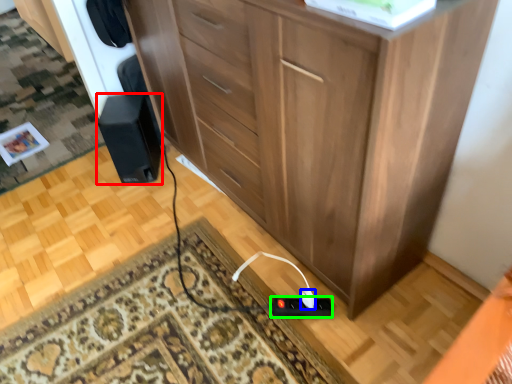
Question: Considering the real-world distances, which object is farthest from speaker (highlighted by a red box)? plug (highlighted by a blue box) or plug (highlighted by a green box)?

Choices:
 (A) plug
 (B) plug

Answer: (A)